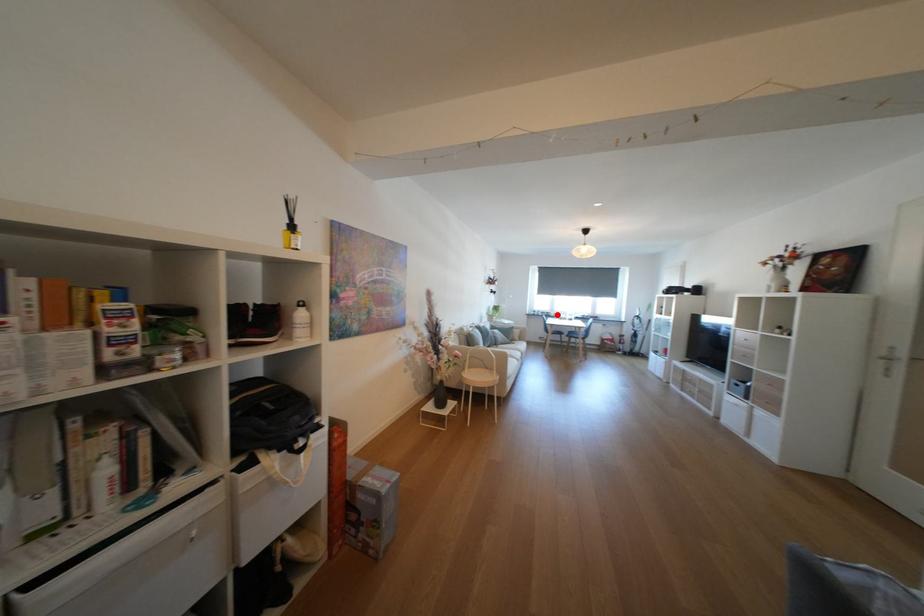
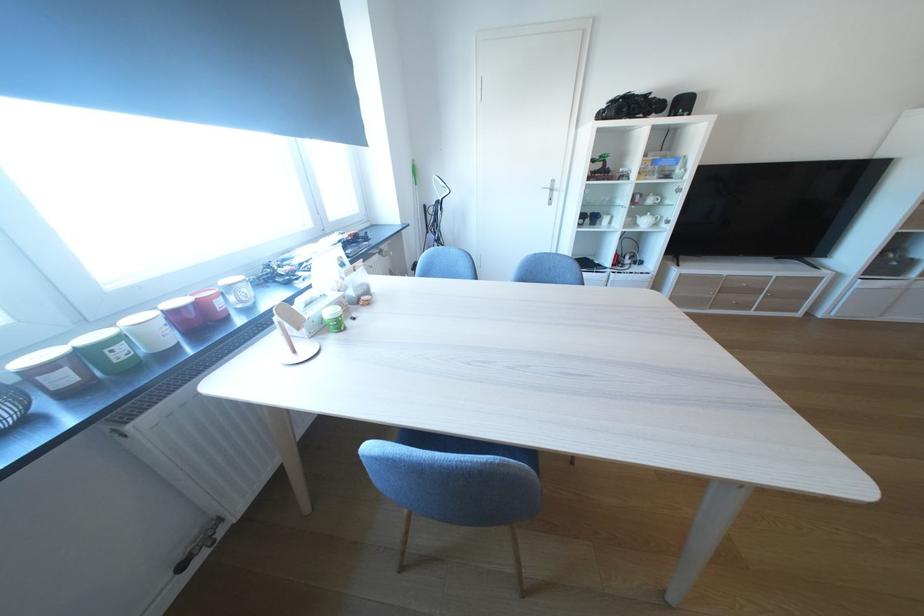
Where in the second image is the point corresponding to the highlighted location from the first image?

(75, 379)